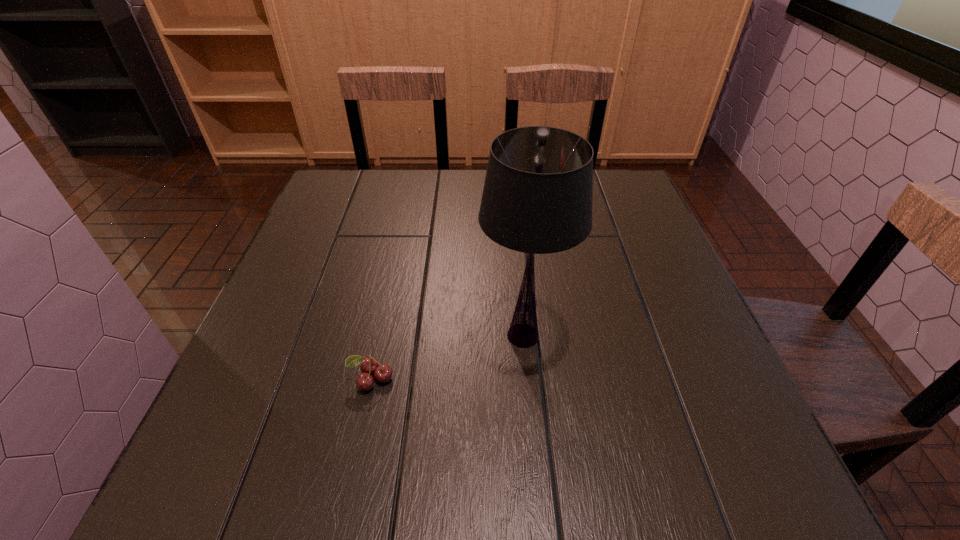
The width and height of the screenshot is (960, 540). I want to click on the taller object, so click(537, 198).

This screenshot has height=540, width=960. What are the coordinates of `lampshade` in the screenshot? It's located at (537, 198).

The width and height of the screenshot is (960, 540). Find the location of `cherry`. cherry is located at coordinates (369, 365).

I want to click on the left object, so click(x=369, y=365).

This screenshot has width=960, height=540. What are the coordinates of `free space located 0.190m on the front-facing side of the lampshade` in the screenshot? It's located at [x=382, y=336].

The width and height of the screenshot is (960, 540). I want to click on vacant space located on the front-facing side of the lampshade, so click(291, 336).

This screenshot has height=540, width=960. I want to click on vacant region located 0.350m on the front-facing side of the lampshade, so click(301, 336).

This screenshot has width=960, height=540. What are the coordinates of `vacant space located 0.120m on the leaves of the shorter object` in the screenshot? It's located at (353, 462).

Locate an element on the screen. vacant space at the far edge of the desktop is located at coordinates (442, 197).

Identify the location of free region at the near edge. Image resolution: width=960 pixels, height=540 pixels. (435, 472).